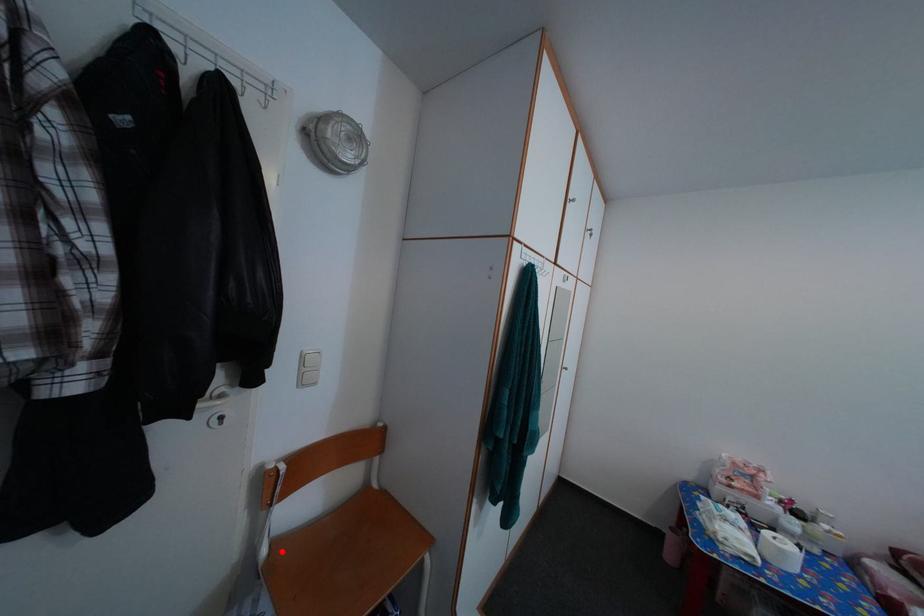
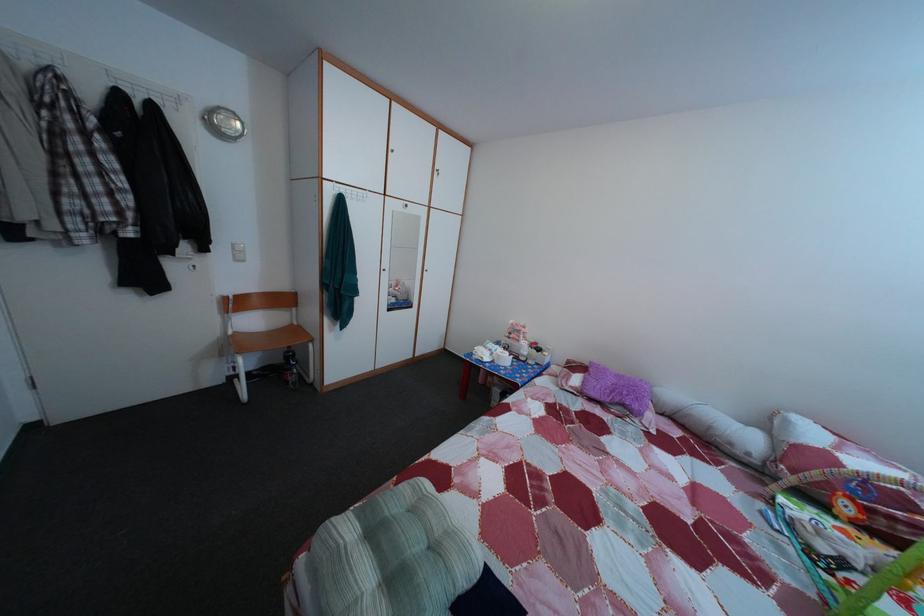
Find the pixel in the second image that matches the highlighted location in the first image.

(245, 339)